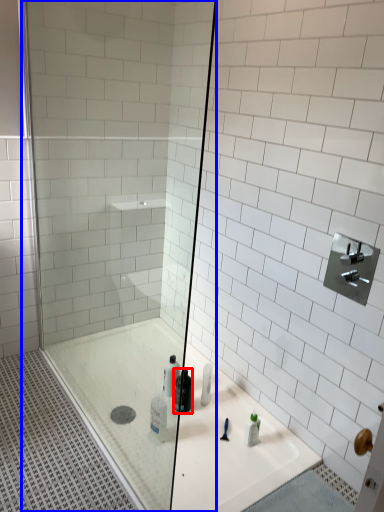
Question: Which point is closer to the camera, mouthwash (highlighted by a red box) or shower door (highlighted by a blue box)?

Choices:
 (A) mouthwash
 (B) shower door

Answer: (B)